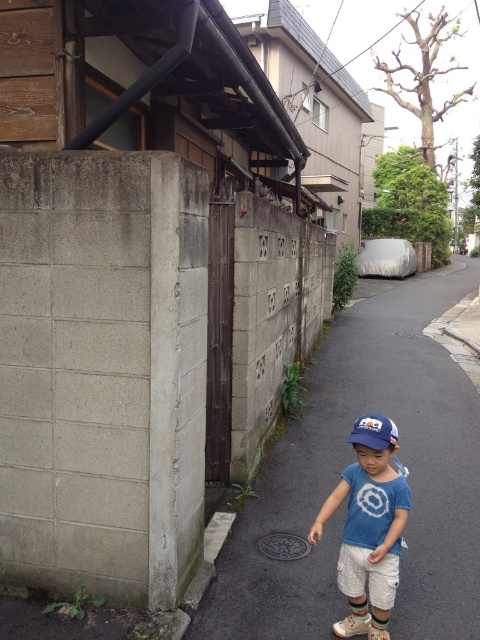
You are a delivery drone flying over the residential street scene. You need to land at one of the two points marked in the image. The first point is at coordinate point (393, 620) and the second is at point (389, 420). Which point is closer to you as you approach the scene?

Point (393, 620) is closer to you because it is further to the viewer than point (389, 420).

What are the coordinates of the blue cotton shirt at center?

The coordinates of the blue cotton shirt at center are at point (369, 525).

You are a tailor who needs to determine if the blue cotton shirt at center can fit into a storage box designed for the blue fabric baseball cap at center. Based on their sizes, can the shirt fit inside the cap box?

The blue cotton shirt at center is larger in size than the blue fabric baseball cap at center, so the shirt cannot fit into the storage box designed for the cap.